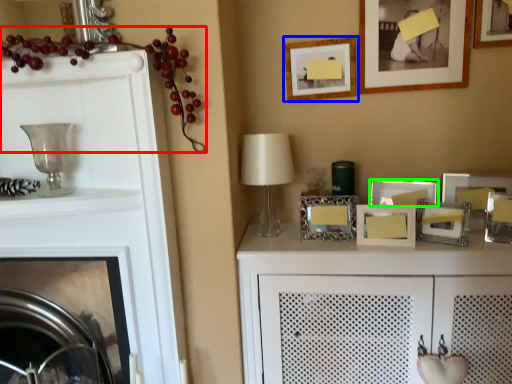
Question: Which object is the farthest from fruit (highlighted by a red box)? Choose among these: picture frame (highlighted by a blue box) or picture frame (highlighted by a green box).

Choices:
 (A) picture frame
 (B) picture frame

Answer: (B)